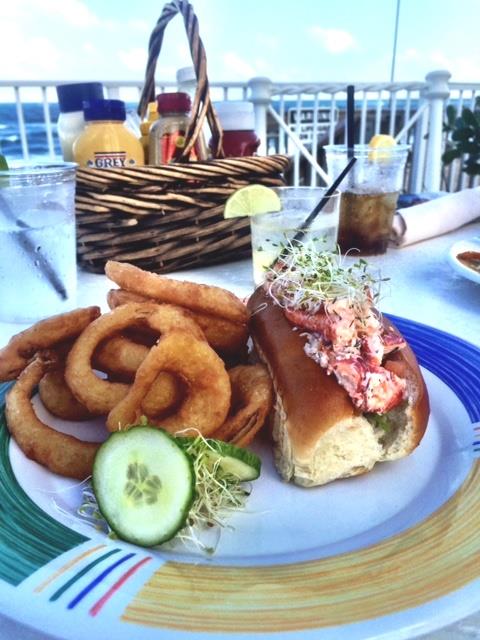
Where is `plate`? plate is located at coordinates (312, 532).